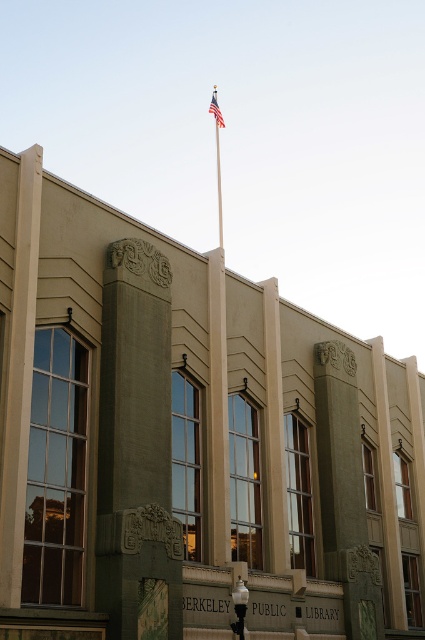
Can you confirm if polished metal flag pole at upper center is taller than american flag at upper center?

Indeed, polished metal flag pole at upper center has a greater height compared to american flag at upper center.

Which is below, polished metal flag pole at upper center or american flag at upper center?

A: polished metal flag pole at upper center is lower down.

Which is in front, point (220, 538) or point (223, 120)?

Positioned in front is point (220, 538).

This screenshot has height=640, width=425. I want to click on polished metal flag pole at upper center, so click(218, 376).